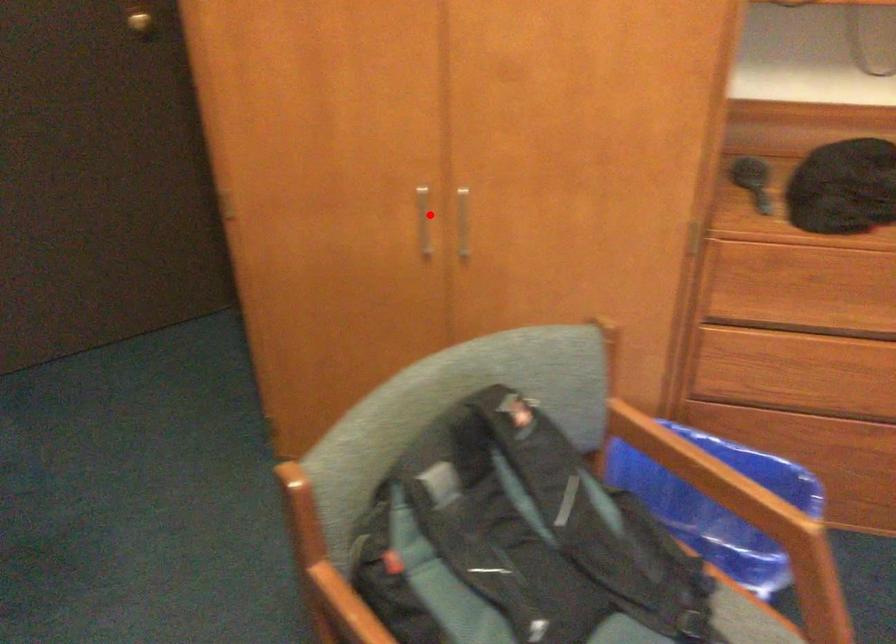
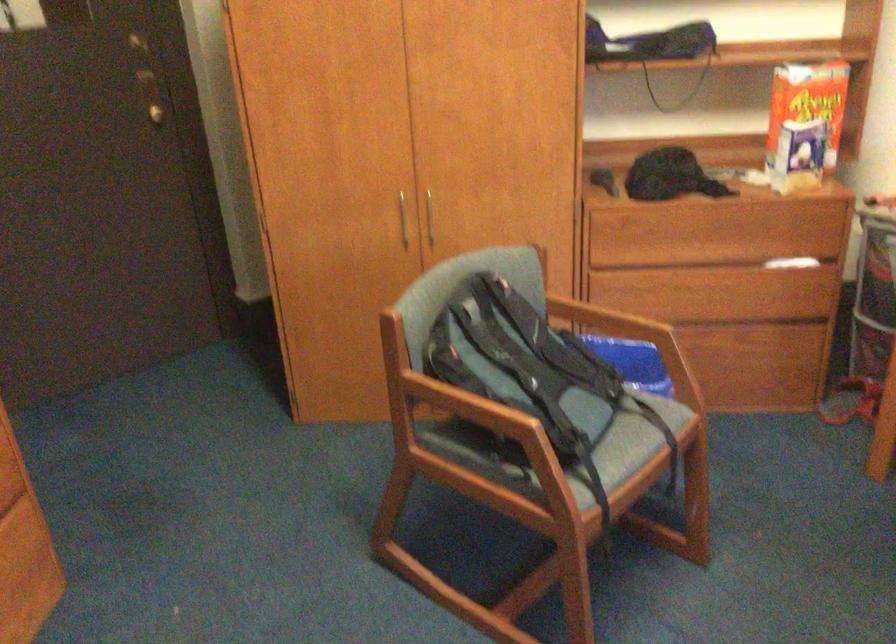
In the second image, find the point that corresponds to the highlighted location in the first image.

(402, 220)